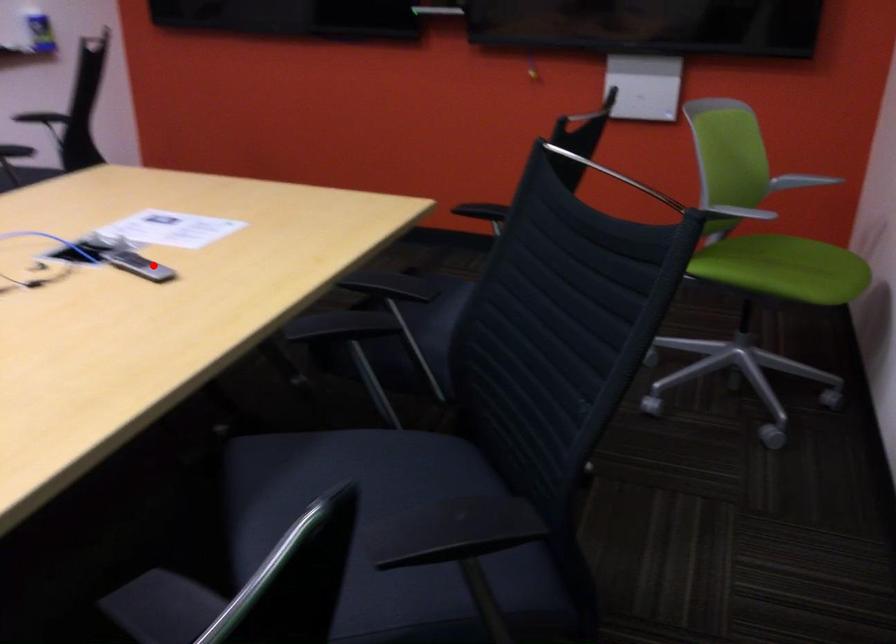
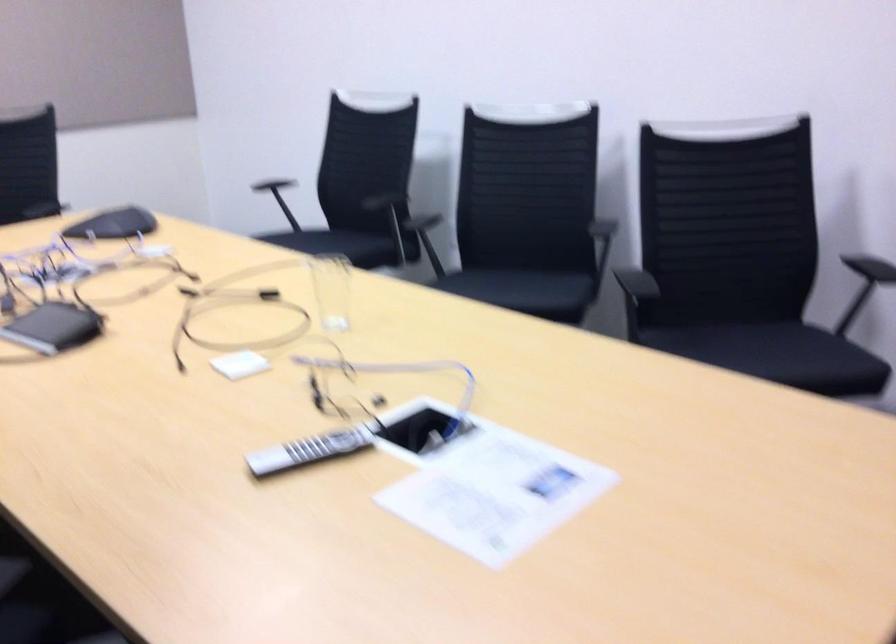
Question: I am providing you with two images of the same scene from different viewpoints. Given a red point in image1, look at the same physical point in image2. Is it:

Choices:
 (A) Closer to the viewpoint
 (B) Farther from the viewpoint

Answer: (A)